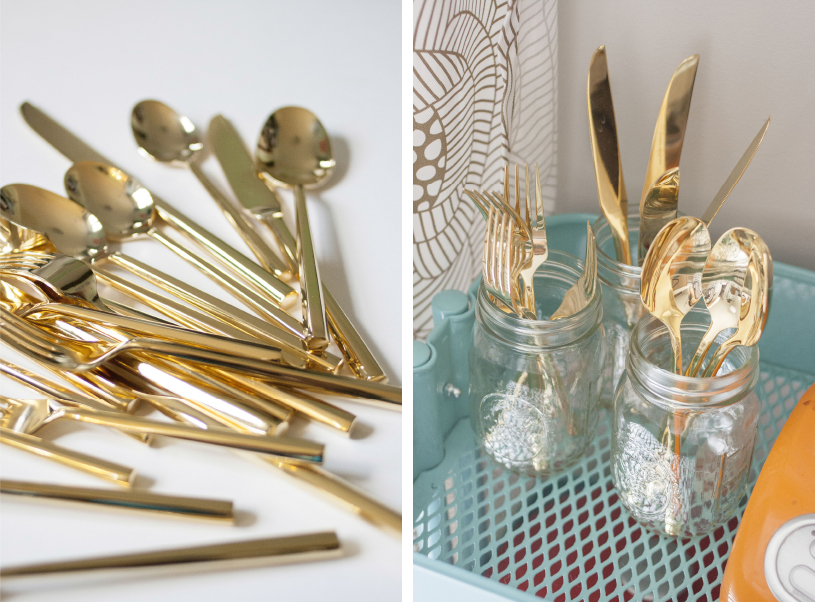
The width and height of the screenshot is (815, 603). I want to click on mason jar, so click(x=531, y=383), click(x=675, y=436), click(x=613, y=313).